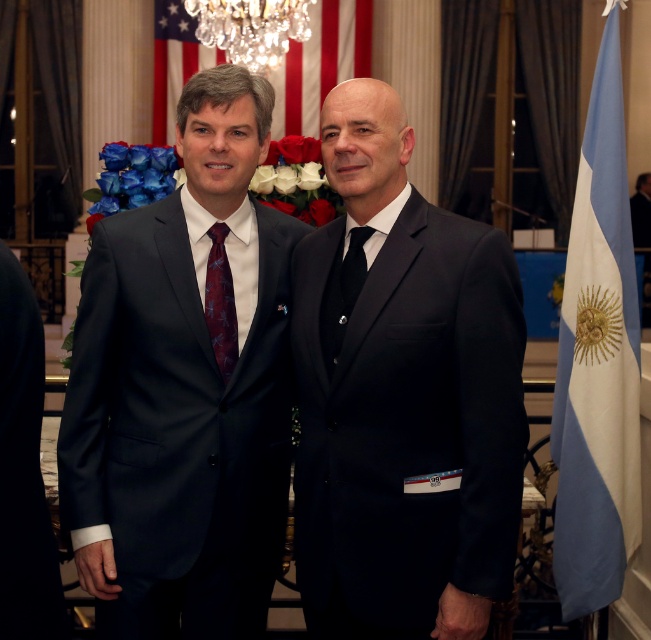
Does matte black suit at center appear on the right side of black silk tie at center?

No, matte black suit at center is not to the right of black silk tie at center.

Is matte black suit at center below black silk tie at center?

Correct, matte black suit at center is located below black silk tie at center.

Is point (184, 433) positioned after point (324, 344)?

Yes, point (184, 433) is farther from viewer.

At what (x,y) coordinates should I click in order to perform the action: click on matte black suit at center. Please return your answer as a coordinate pair (x, y). The image size is (651, 640). Looking at the image, I should click on [x=184, y=392].

Between blue fabric flag at right and crystal glass chandelier at upper center, which one appears on the right side from the viewer's perspective?

blue fabric flag at right

Does point (615, 128) lie behind point (253, 3)?

No, (615, 128) is in front of (253, 3).

Between point (607, 356) and point (279, 58), which one is positioned behind?

Point (279, 58)

Where is `blue fabric flag at right`? blue fabric flag at right is located at coordinates (598, 362).

Which is more to the right, american flag at upper center or black silk tie at center?

From the viewer's perspective, black silk tie at center appears more on the right side.

Which of these two, american flag at upper center or black silk tie at center, stands shorter?

Standing shorter between the two is black silk tie at center.

Who is more distant from viewer, [337,68] or [335,282]?

The point [337,68] is behind.

At what (x,y) coordinates should I click in order to perform the action: click on american flag at upper center. Please return your answer as a coordinate pair (x, y). The width and height of the screenshot is (651, 640). Looking at the image, I should click on (320, 64).